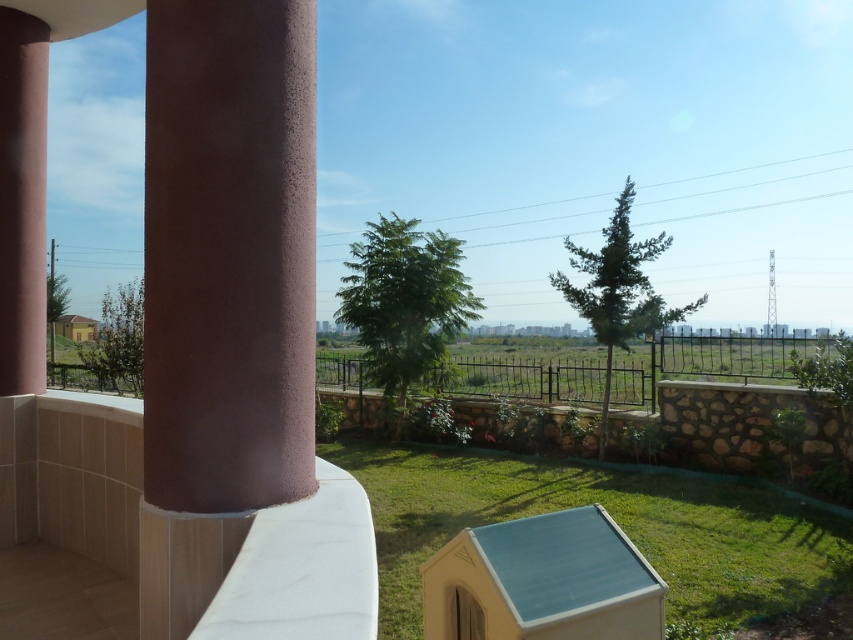
Is sandy pink concrete pillar at left further to camera compared to matte pink column at left?

No, sandy pink concrete pillar at left is in front of matte pink column at left.

Is point (178, 74) positioned before point (10, 29)?

Yes, point (178, 74) is in front of point (10, 29).

At what (x,y) coordinates should I click in order to perform the action: click on sandy pink concrete pillar at left. Please return your answer as a coordinate pair (x, y). The image size is (853, 640). Looking at the image, I should click on [x=228, y=253].